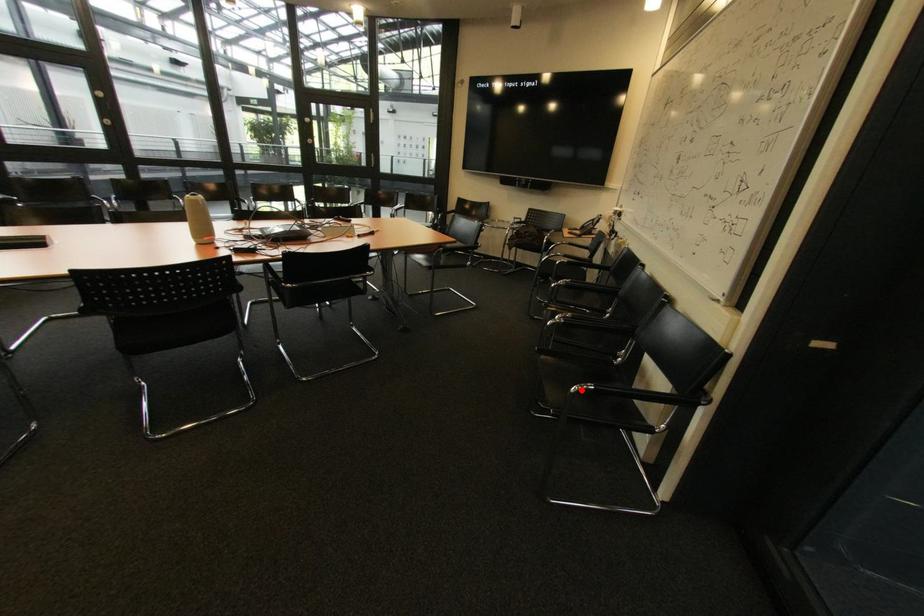
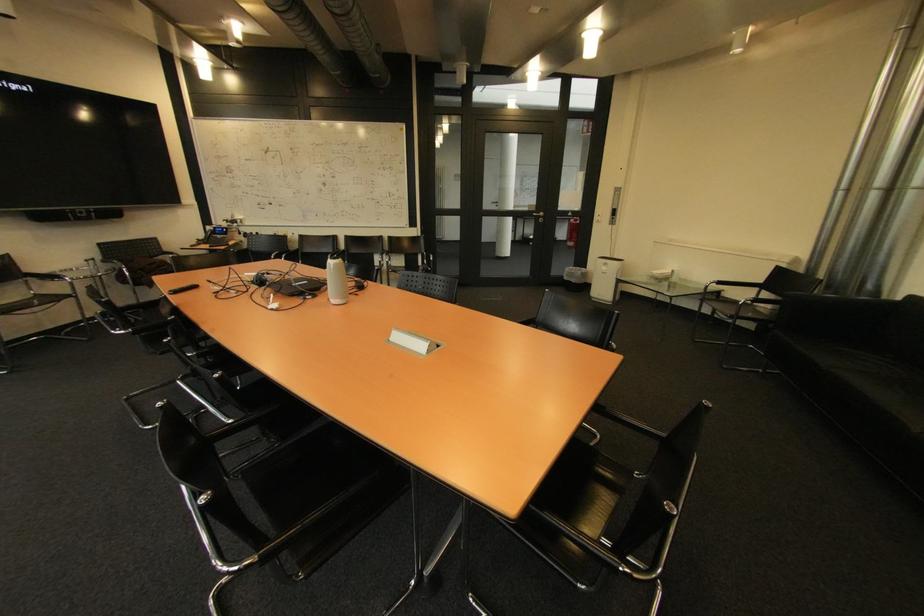
Question: I am providing you with two images of the same scene from different viewpoints. A red point is marked on the first image. At the location where the point appears in image 1, is it still visible in image 2?

Choices:
 (A) Yes
 (B) No

Answer: (B)